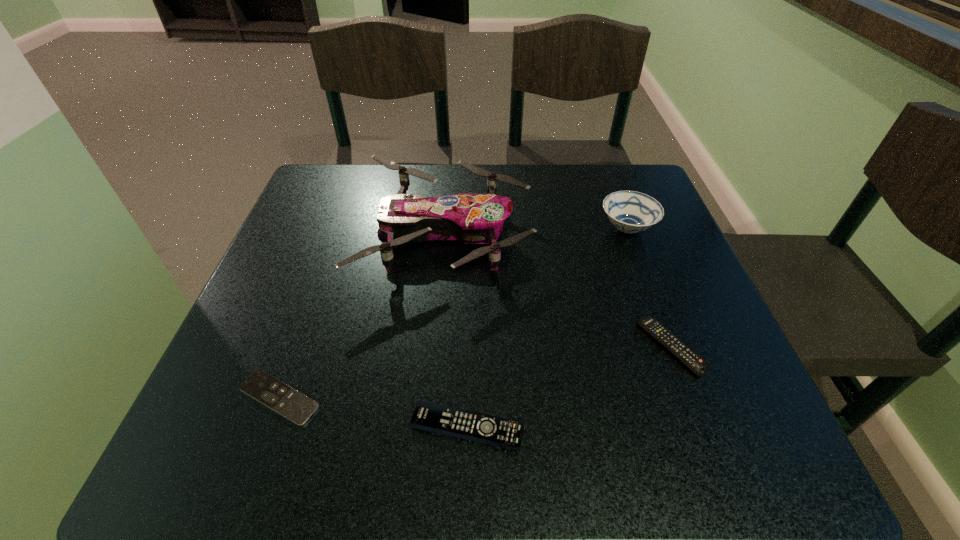
Locate an element on the screen. Image resolution: width=960 pixels, height=540 pixels. unoccupied area between the fourth shortest object and the second remote control from left to right is located at coordinates (547, 328).

Where is `vacant area that lies between the rightmost remote control and the second tallest object`? The height and width of the screenshot is (540, 960). vacant area that lies between the rightmost remote control and the second tallest object is located at coordinates (649, 288).

Where is `free spot between the shortest object and the soup bowl`? free spot between the shortest object and the soup bowl is located at coordinates (453, 313).

You are a GUI agent. You are given a task and a screenshot of the screen. Output one action in this format:
    pyautogui.click(x=<x>, y=<y>)
    Task: Click on the free space between the second remote control from right to left and the rightmost remote control
    The image size is (960, 540).
    Given the screenshot: What is the action you would take?
    pyautogui.click(x=568, y=387)

Identify the location of vacant region between the second remote control from right to left and the rightmost remote control. This screenshot has width=960, height=540. (568, 387).

Locate which object ranks third in proximity to the shortest object. Please provide its 2D coordinates. Your answer should be formatted as a tuple, i.e. [(x, y)], where the tuple contains the x and y coordinates of a point satisfying the conditions above.

[(668, 340)]

Point out which object is positioned as the fourth nearest to the shortest object. Please provide its 2D coordinates. Your answer should be formatted as a tuple, i.e. [(x, y)], where the tuple contains the x and y coordinates of a point satisfying the conditions above.

[(629, 211)]

The width and height of the screenshot is (960, 540). What are the coordinates of `the third closest remote control to the drone` in the screenshot? It's located at (492, 430).

In order to click on remote control that can be found as the closest to the soup bowl in this screenshot , I will do click(x=668, y=340).

Find the location of a particular element. Image resolution: width=960 pixels, height=540 pixels. vacant space that satisfies the following two spatial constraints: 1. on the front-facing side of the tallest object; 2. on the right side of the rightmost remote control is located at coordinates (438, 347).